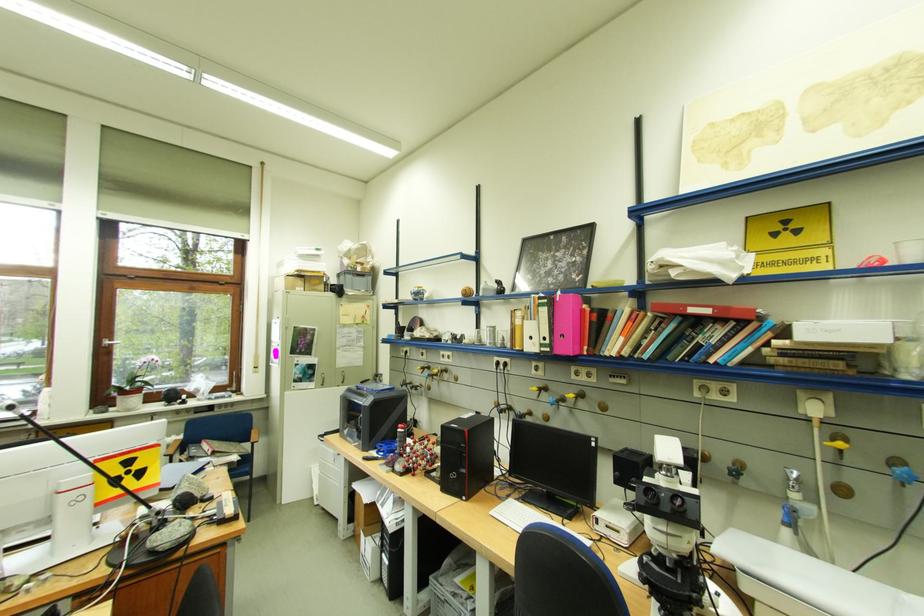
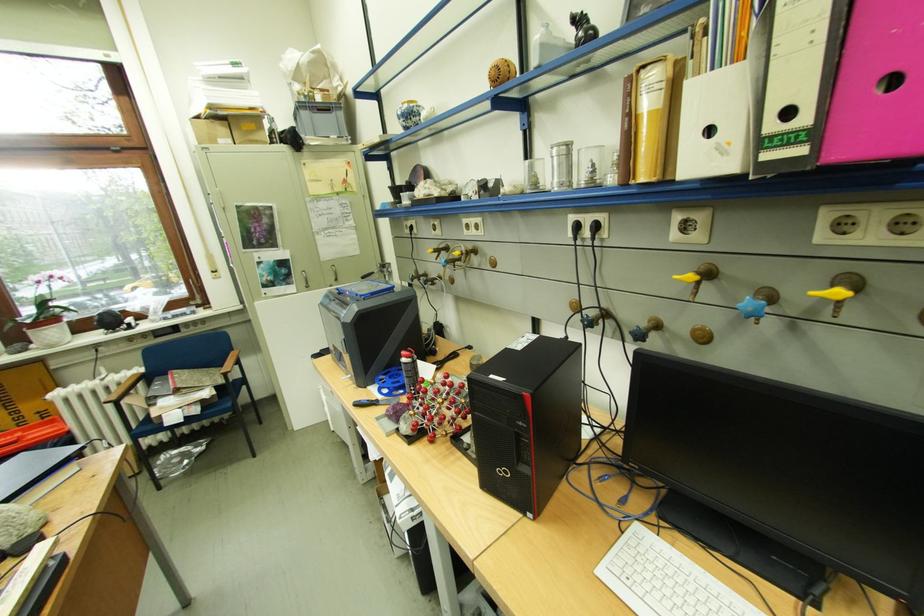
The point at (503, 514) is marked in the first image. Where is the corresponding point in the second image?

(612, 573)